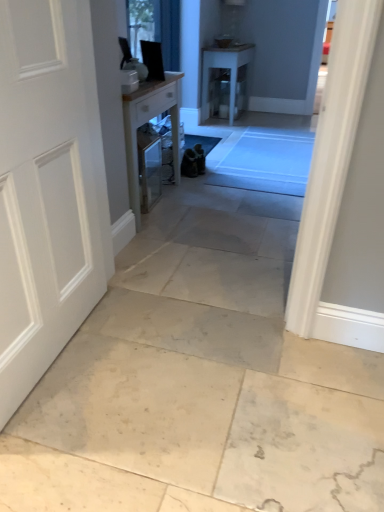
Question: Considering the positions of white matte door at left and wooden table at center, which appears as the 1th table when viewed from the left, in the image, is white matte door at left wider or thinner than wooden table at center, which appears as the 1th table when viewed from the left,?

Choices:
 (A) wide
 (B) thin

Answer: (B)

Question: In terms of size, does white matte door at left appear bigger or smaller than wooden table at center, the first table positioned from the bottom?

Choices:
 (A) small
 (B) big

Answer: (A)

Question: Estimate the real-world distances between objects in this image. Which object is farther from the white glossy table at center, which is the 2th table from bottom to top?

Choices:
 (A) clear glass window at upper center
 (B) wooden table at center, positioned as the 2th table in back-to-front order
 (C) white matte door at left

Answer: (C)

Question: Based on their relative distances, which object is farther from the clear glass window at upper center?

Choices:
 (A) white glossy table at center, which ranks as the 2th table in left-to-right order
 (B) wooden table at center, which appears as the 1th table when viewed from the left
 (C) white matte door at left

Answer: (A)